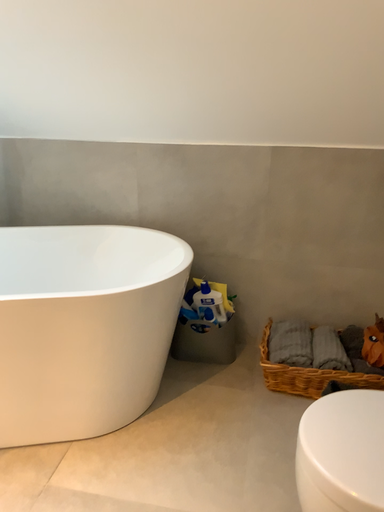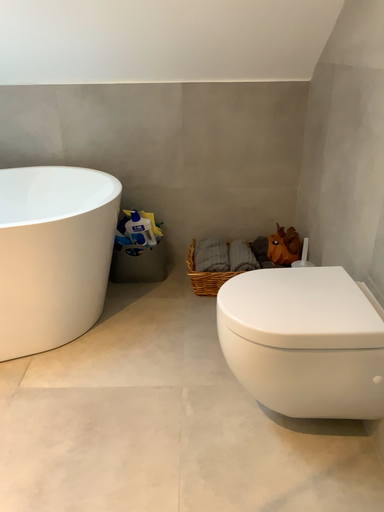
Question: How did the camera likely rotate when shooting the video?

Choices:
 (A) rotated downward
 (B) rotated upward

Answer: (A)